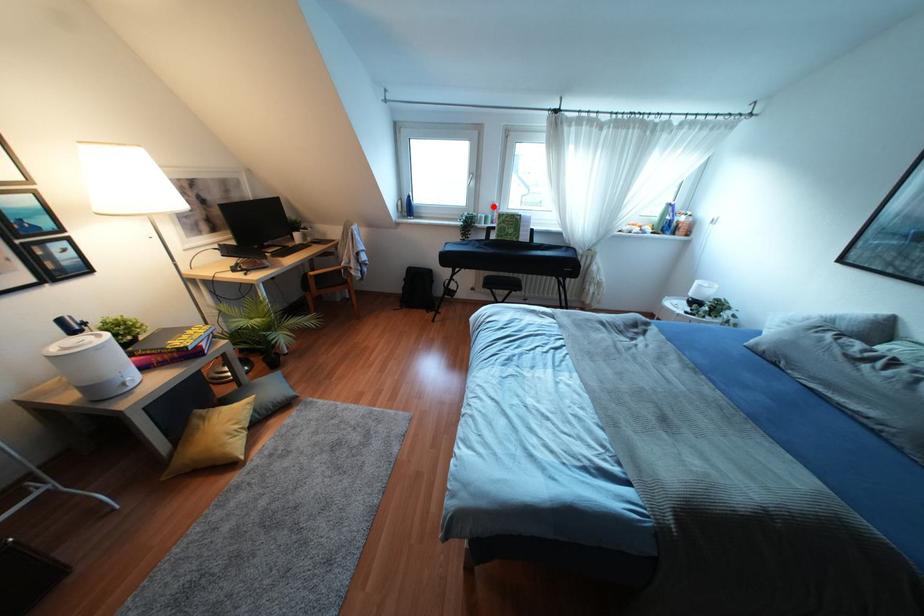
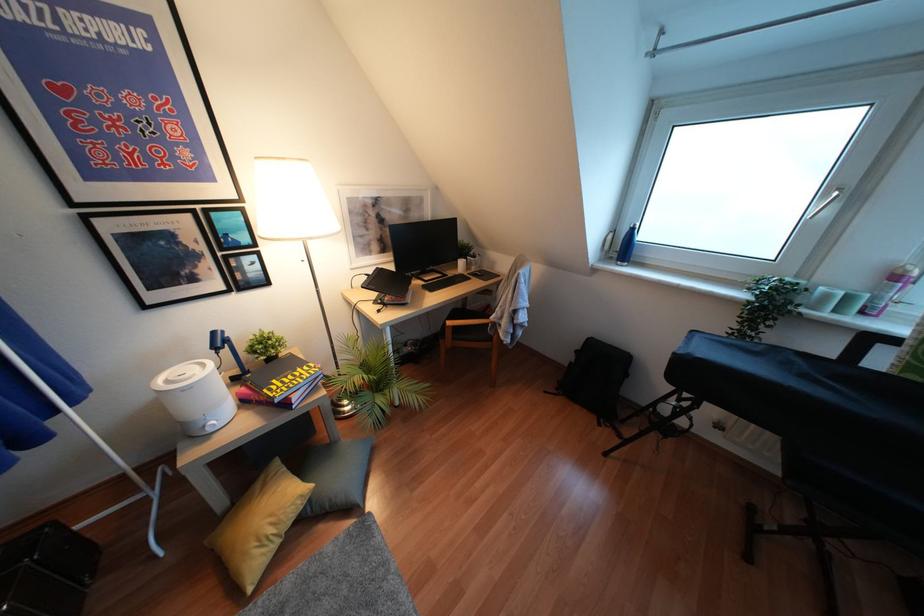
Locate, in the second image, the point that corresponds to the highlighted location in the first image.

(895, 277)